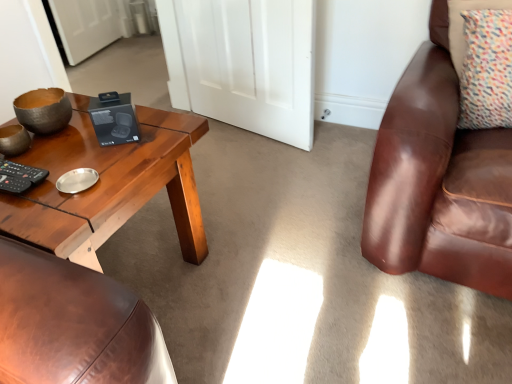
I want to click on free spot to the right of woodenmaterial/texturecoffee table at left, so click(268, 274).